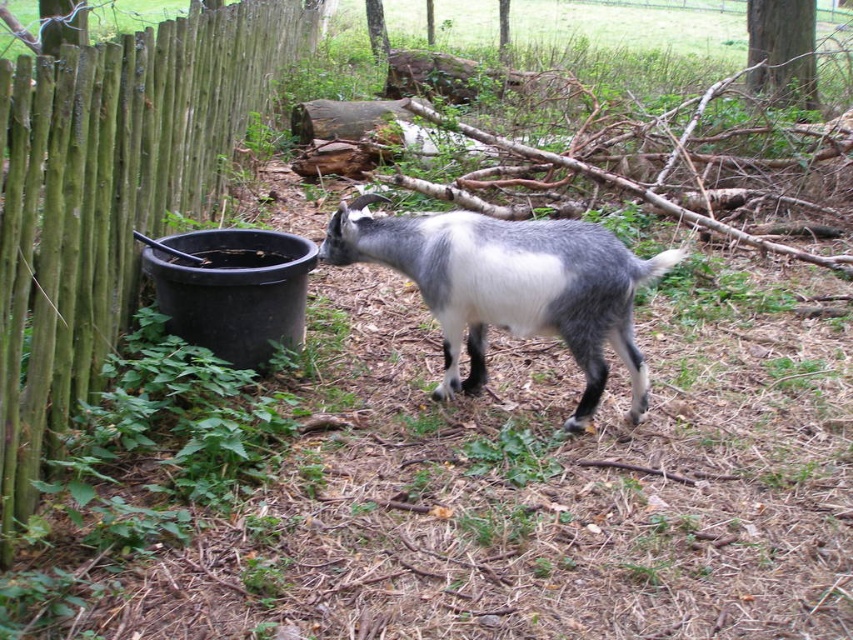
Does green wood fence at left have a greater height compared to gray woolen goat at center?

Indeed, green wood fence at left has a greater height compared to gray woolen goat at center.

What do you see at coordinates (109, 196) in the screenshot? This screenshot has width=853, height=640. I see `green wood fence at left` at bounding box center [109, 196].

Locate an element on the screen. This screenshot has height=640, width=853. green wood fence at left is located at coordinates (109, 196).

Locate an element on the screen. green wood fence at left is located at coordinates (109, 196).